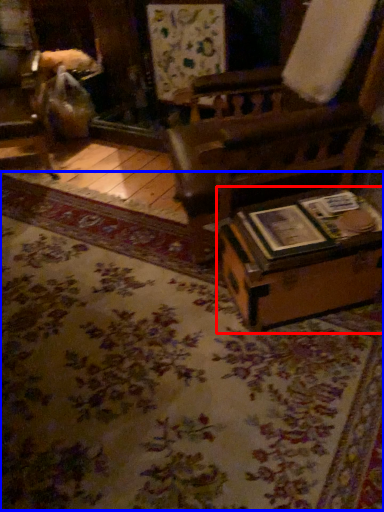
Question: Which of the following is the farthest to the observer, table (highlighted by a red box) or mat (highlighted by a blue box)?

Choices:
 (A) table
 (B) mat

Answer: (A)